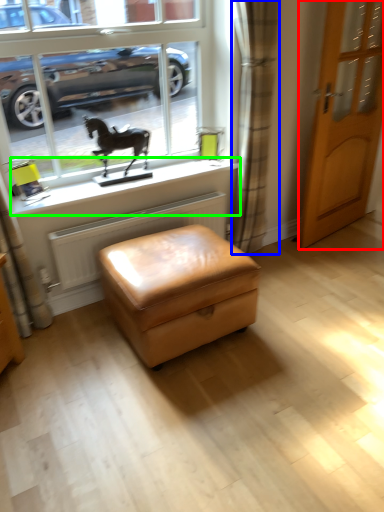
Question: Which is farther away from door (highlighted by a red box)? curtain (highlighted by a blue box) or window sill (highlighted by a green box)?

Choices:
 (A) curtain
 (B) window sill

Answer: (B)